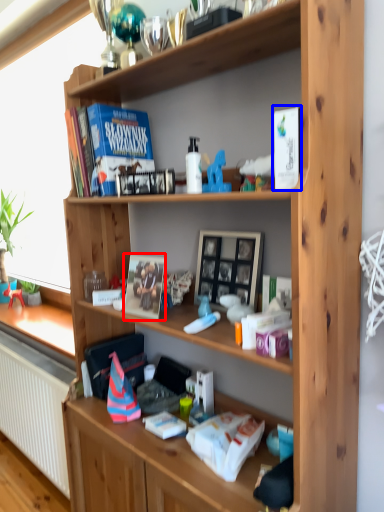
Question: Which point is closer to the camera, paperback book (highlighted by a red box) or paperback book (highlighted by a blue box)?

Choices:
 (A) paperback book
 (B) paperback book

Answer: (B)